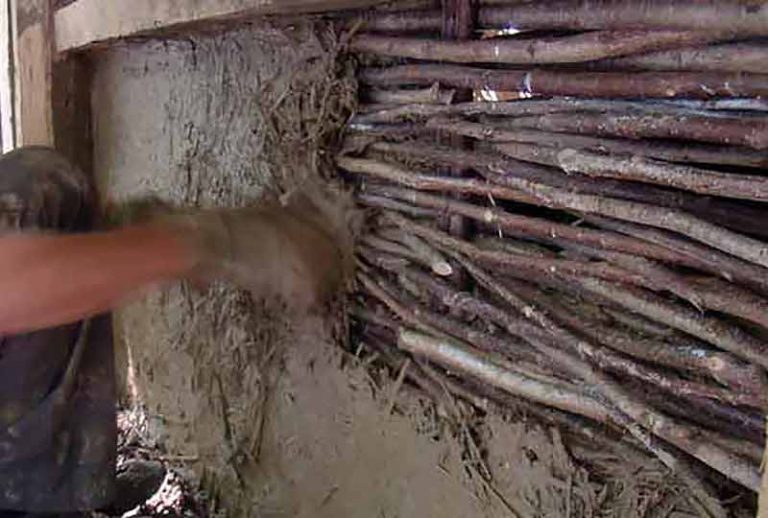
Find the location of `light shining through the doorway`. light shining through the doorway is located at coordinates (8, 125).